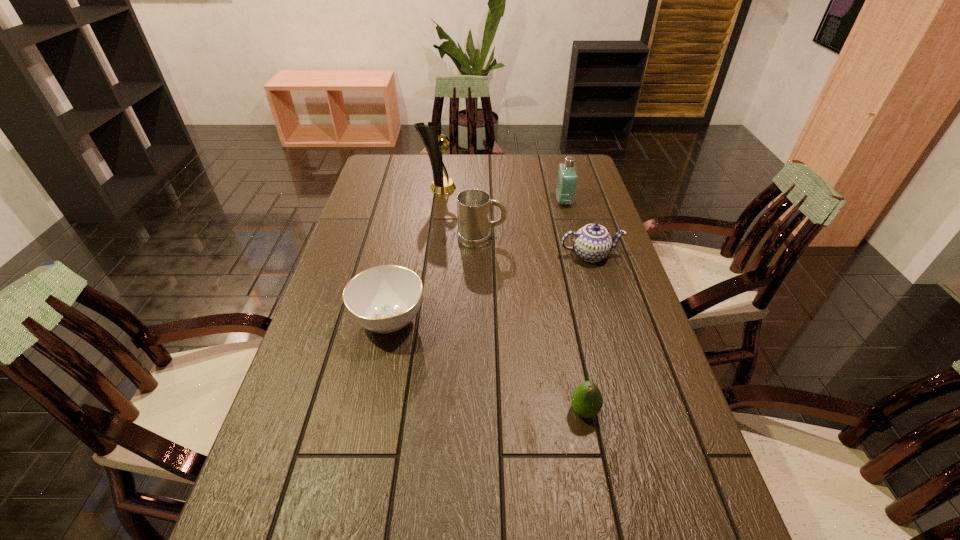
Identify the location of vacant region located 0.100m on the front label of the perfume. (528, 201).

At what (x,y) coordinates should I click in order to perform the action: click on vacant space located 0.260m on the side of the fourth object from right to left with the handle. Please return your answer as a coordinate pair (x, y). Image resolution: width=960 pixels, height=540 pixels. Looking at the image, I should click on click(585, 238).

This screenshot has width=960, height=540. Identify the location of vacant space positioned at the spout of the right chinaware. point(616,343).

The width and height of the screenshot is (960, 540). Find the location of `free spot located 0.080m on the right of the fifth farthest object`. free spot located 0.080m on the right of the fifth farthest object is located at coordinates (456, 320).

Locate an element on the screen. vacant space located 0.400m on the left of the avocado is located at coordinates (389, 411).

The image size is (960, 540). Identify the location of object at the far edge. (431, 135).

Image resolution: width=960 pixels, height=540 pixels. In order to click on object located at the left edge in this screenshot , I will do `click(383, 299)`.

I want to click on perfume that is at the right edge, so click(567, 177).

What are the coordinates of `chinaware that is at the right edge` in the screenshot? It's located at (592, 243).

In the image, there is a desktop. Where is `free space at the far edge`? free space at the far edge is located at coordinates (535, 181).